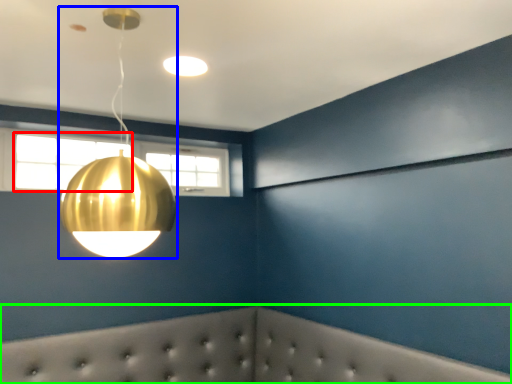
Question: Estimate the real-world distances between objects in this image. Which object is farther from window (highlighted by a red box), lamp (highlighted by a blue box) or furniture (highlighted by a green box)?

Choices:
 (A) lamp
 (B) furniture

Answer: (A)